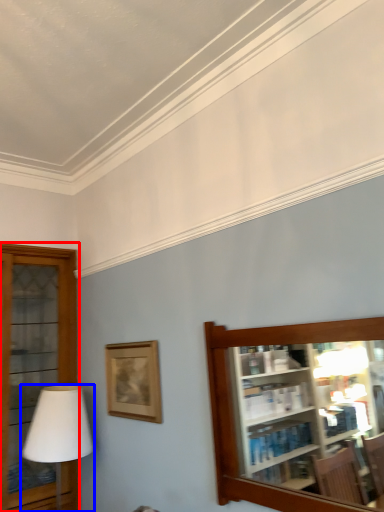
Question: Which of the following is the farthest to the observer, shelf (highlighted by a red box) or table lamp (highlighted by a blue box)?

Choices:
 (A) shelf
 (B) table lamp

Answer: (A)